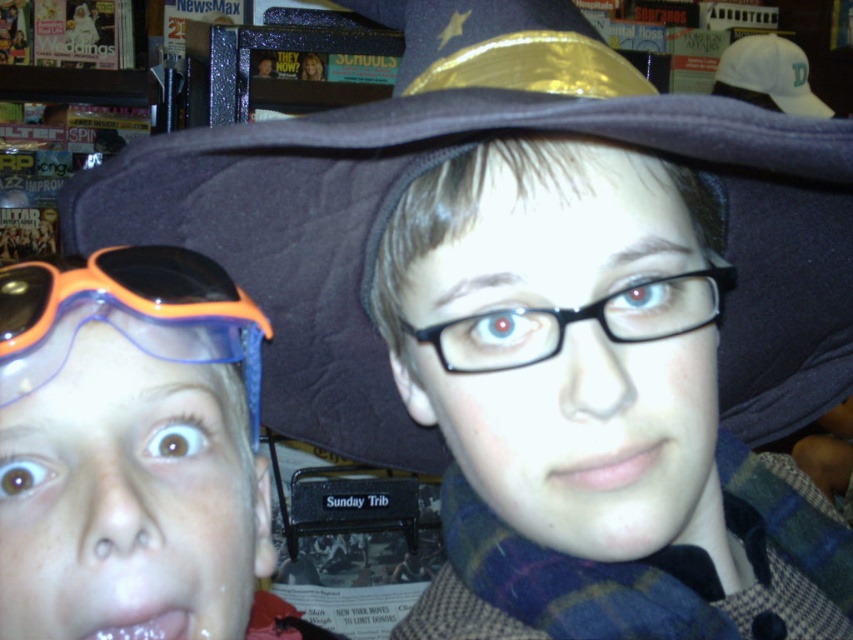
You are designing a display stand that needs to accommodate both the dark felt witch hat at upper center and the black plastic glasses at center. Given their sizes, which object requires a wider space on the stand?

The dark felt witch hat at upper center requires a wider space on the stand because its width surpasses that of the black plastic glasses at center.